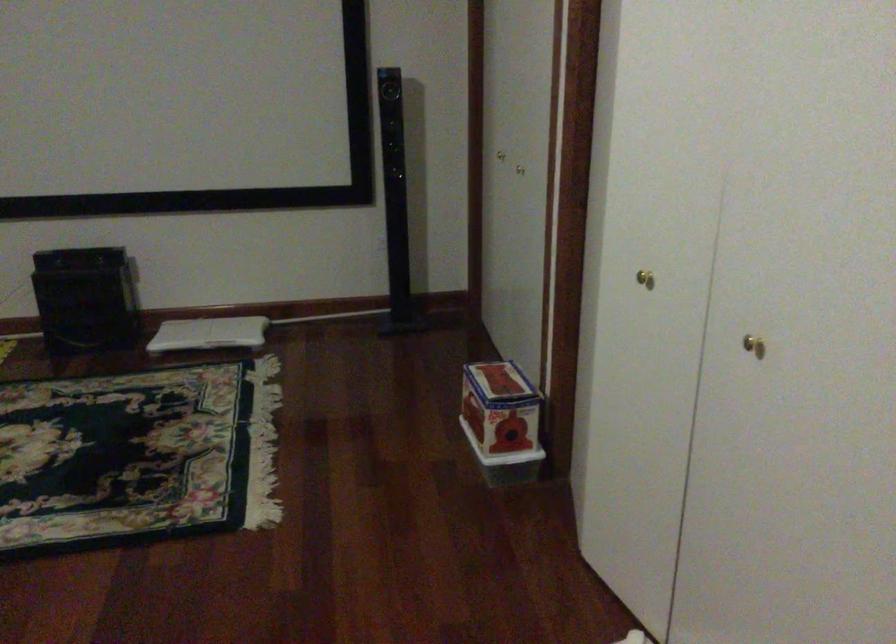
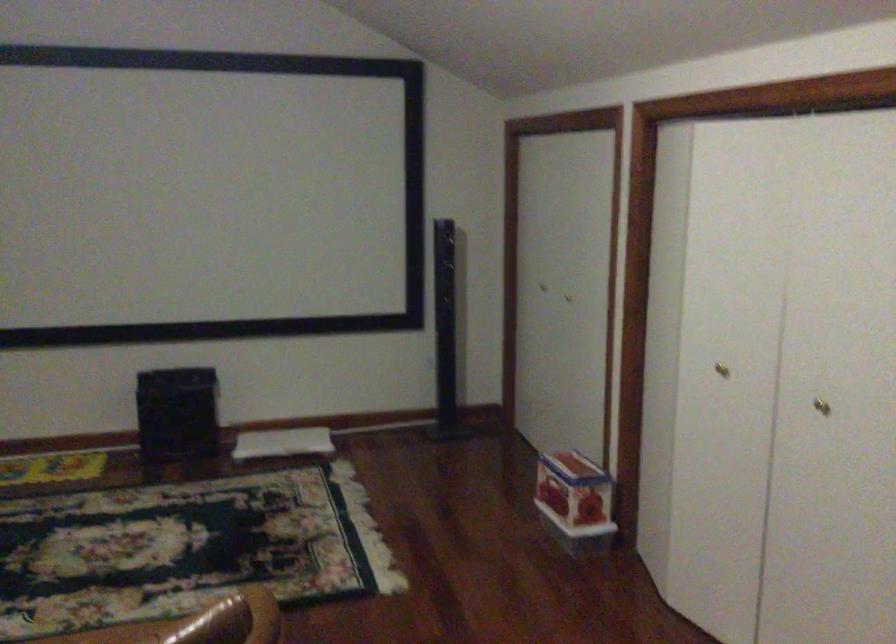
In the second image, find the point that corresponds to [488,418] in the first image.

(574, 494)